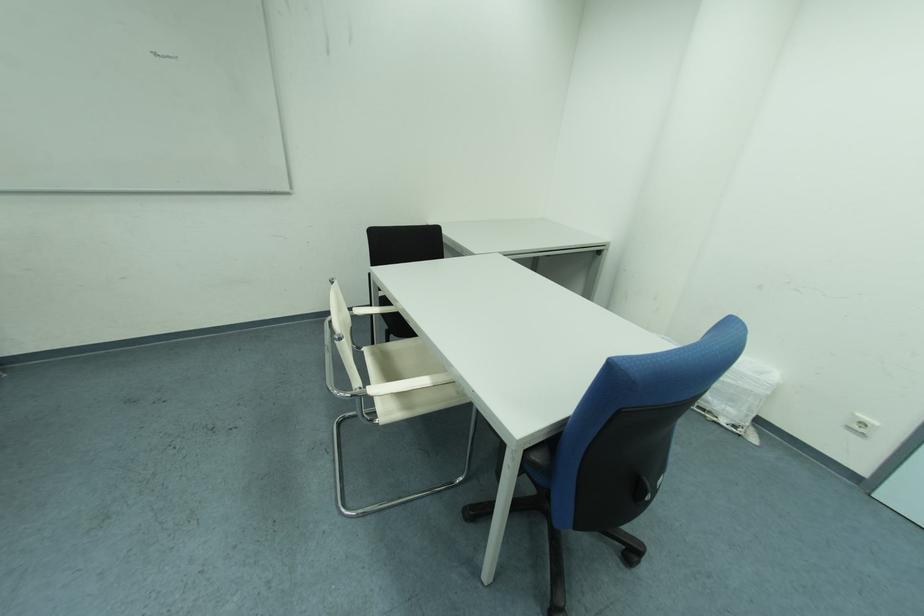
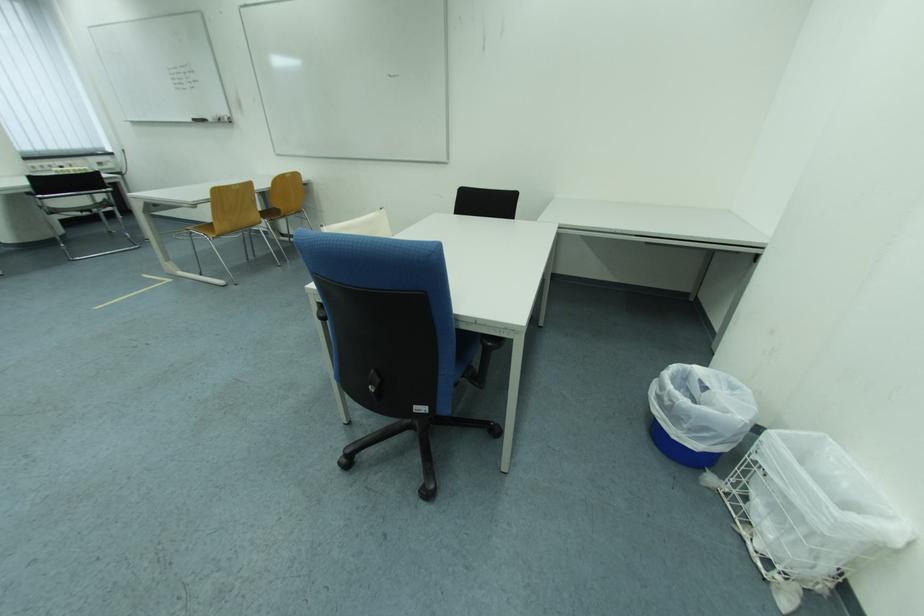
In the second image, find the point that corresponds to point 718,422 in the first image.

(745, 532)